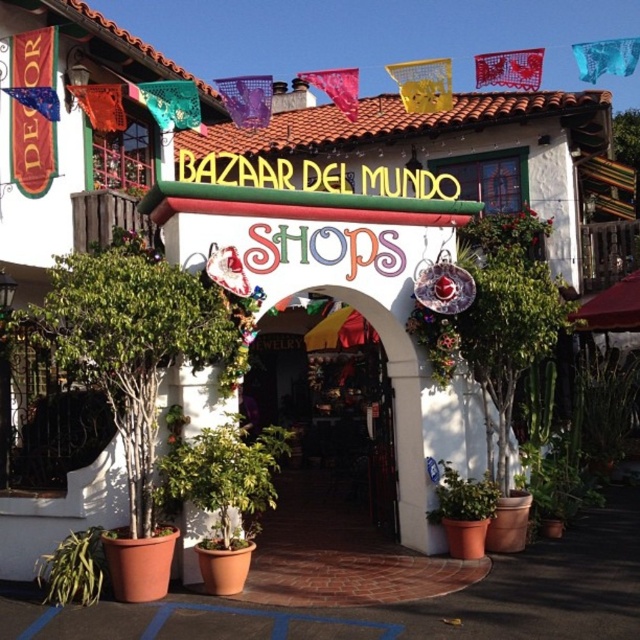
You are standing at the entrance of Bazaar del Mundo Shops and notice a green leafy plant at center. Can you determine its exact position using the coordinate system provided?

The green leafy plant at center is located at point (225,477).

You are a delivery person trying to enter the Bazaar del Mundo Shops. You see the wooden door at center and the green matte plant at lower left. Which object is closer to you as you face the entrance?

The wooden door at center is closer to you than the green matte plant at lower left because it is positioned over it, indicating it is in front.